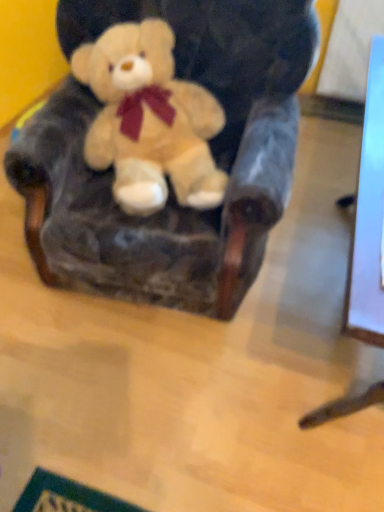
Consider the image. What is the approximate width of velvet plush bear at center?

velvet plush bear at center is 86.97 centimeters in width.

What do you see at coordinates (170, 188) in the screenshot? I see `velvet plush bear at center` at bounding box center [170, 188].

Locate an element on the screen. velvet plush bear at center is located at coordinates (170, 188).

Describe the element at coordinates (149, 120) in the screenshot. I see `soft plush teddy bear at center` at that location.

The image size is (384, 512). I want to click on soft plush teddy bear at center, so click(x=149, y=120).

In order to face soft plush teddy bear at center, should I rotate leftwards or rightwards?

It's best to rotate left around 5.217 degrees.

Image resolution: width=384 pixels, height=512 pixels. What are the coordinates of `velvet plush bear at center` in the screenshot? It's located at (170, 188).

Between velvet plush bear at center and soft plush teddy bear at center, which one appears on the right side from the viewer's perspective?

Positioned to the right is velvet plush bear at center.

Is velvet plush bear at center in front of soft plush teddy bear at center?

Yes, it is.

Does point (70, 21) lie in front of point (122, 37)?

No.

From the image's perspective, is velvet plush bear at center below soft plush teddy bear at center?

Yes, from the image's perspective, velvet plush bear at center is beneath soft plush teddy bear at center.

From a real-world perspective, is velvet plush bear at center positioned over soft plush teddy bear at center based on gravity?

No, from a real-world perspective, velvet plush bear at center is not above soft plush teddy bear at center.

In the scene shown: Considering the sizes of objects velvet plush bear at center and soft plush teddy bear at center in the image provided, who is thinner, velvet plush bear at center or soft plush teddy bear at center?

Thinner between the two is soft plush teddy bear at center.

Between velvet plush bear at center and soft plush teddy bear at center, which one has less height?

soft plush teddy bear at center.

Is velvet plush bear at center smaller than soft plush teddy bear at center?

No.

From the picture: Is velvet plush bear at center completely or partially outside of soft plush teddy bear at center?

Indeed, velvet plush bear at center is completely outside soft plush teddy bear at center.

Is there a large distance between velvet plush bear at center and soft plush teddy bear at center?

That's not correct — velvet plush bear at center is a little close to soft plush teddy bear at center.

Could you tell me if velvet plush bear at center is turned towards soft plush teddy bear at center?

Yes, velvet plush bear at center is aimed at soft plush teddy bear at center.

How much distance is there between velvet plush bear at center and soft plush teddy bear at center?

velvet plush bear at center is 5.26 inches away from soft plush teddy bear at center.

The width and height of the screenshot is (384, 512). I want to click on armchair that appears below the soft plush teddy bear at center (from a real-world perspective), so click(170, 188).

Which is more to the right, soft plush teddy bear at center or velvet plush bear at center?

Positioned to the right is velvet plush bear at center.

Based on the photo, is soft plush teddy bear at center in front of or behind velvet plush bear at center in the image?

soft plush teddy bear at center is positioned farther from the viewer than velvet plush bear at center.

Which is farther, (x=142, y=124) or (x=216, y=85)?

The point (x=216, y=85) is farther.

From the image's perspective, relative to velvet plush bear at center, is soft plush teddy bear at center above or below?

Clearly, from the image's perspective, soft plush teddy bear at center is above velvet plush bear at center.

From a real-world perspective, is soft plush teddy bear at center on top of velvet plush bear at center?

Indeed, from a real-world perspective, soft plush teddy bear at center stands above velvet plush bear at center.

From the picture: Looking at their sizes, would you say soft plush teddy bear at center is wider or thinner than velvet plush bear at center?

In the image, soft plush teddy bear at center appears to be more narrow than velvet plush bear at center.

Considering the sizes of objects soft plush teddy bear at center and velvet plush bear at center in the image provided, who is shorter, soft plush teddy bear at center or velvet plush bear at center?

soft plush teddy bear at center.

Is soft plush teddy bear at center bigger than velvet plush bear at center?

No.

Is soft plush teddy bear at center spatially inside velvet plush bear at center, or outside of it?

soft plush teddy bear at center exists entirely within velvet plush bear at center.

Is soft plush teddy bear at center with velvet plush bear at center?

No, soft plush teddy bear at center is not with velvet plush bear at center.

Is soft plush teddy bear at center aimed at velvet plush bear at center?

Yes, soft plush teddy bear at center is aimed at velvet plush bear at center.

Can you tell me how much soft plush teddy bear at center and velvet plush bear at center differ in facing direction?

The angular difference between soft plush teddy bear at center and velvet plush bear at center is 25 degrees.

I want to click on armchair below the soft plush teddy bear at center (from a real-world perspective), so click(x=170, y=188).

In order to click on armchair that is in front of the soft plush teddy bear at center in this screenshot , I will do `click(170, 188)`.

In the image, there is a soft plush teddy bear at center. Where is `armchair below it (from the image's perspective)`? Image resolution: width=384 pixels, height=512 pixels. armchair below it (from the image's perspective) is located at coordinates (170, 188).